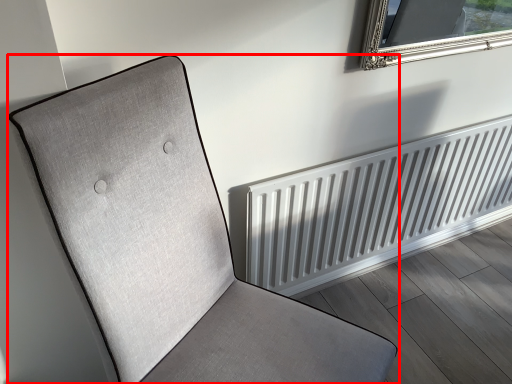
Question: From the image's perspective, considering the relative positions of furniture (annotated by the red box) and radiator in the image provided, where is furniture (annotated by the red box) located with respect to the staircase?

Choices:
 (A) below
 (B) above

Answer: (A)